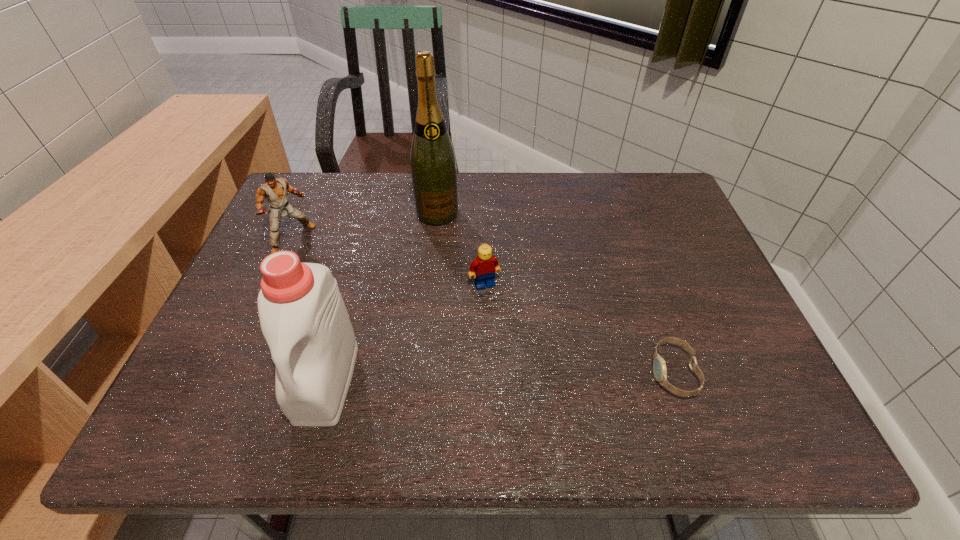
Locate an element on the screen. the fourth shortest object is located at coordinates (303, 317).

Locate an element on the screen. This screenshot has height=540, width=960. detergent is located at coordinates (303, 317).

At what (x,y) coordinates should I click in order to perform the action: click on the rightmost object. Please return your answer as a coordinate pair (x, y). The height and width of the screenshot is (540, 960). Looking at the image, I should click on (659, 365).

Where is `the shortest object`? This screenshot has height=540, width=960. the shortest object is located at coordinates (659, 365).

Identify the location of wine bottle. The width and height of the screenshot is (960, 540). (432, 160).

Where is `the tallest object`? The image size is (960, 540). the tallest object is located at coordinates (432, 160).

You are a GUI agent. You are given a task and a screenshot of the screen. Output one action in this format:
    pyautogui.click(x=<x>, y=<y>)
    Task: Click on the third shortest object
    The image size is (960, 540).
    Given the screenshot: What is the action you would take?
    pyautogui.click(x=275, y=191)

The width and height of the screenshot is (960, 540). What are the coordinates of `the leftmost object` in the screenshot? It's located at (275, 191).

This screenshot has height=540, width=960. What are the coordinates of `the fourth tallest object` in the screenshot? It's located at (485, 265).

Locate an element on the screen. This screenshot has width=960, height=540. the third farthest object is located at coordinates (485, 265).